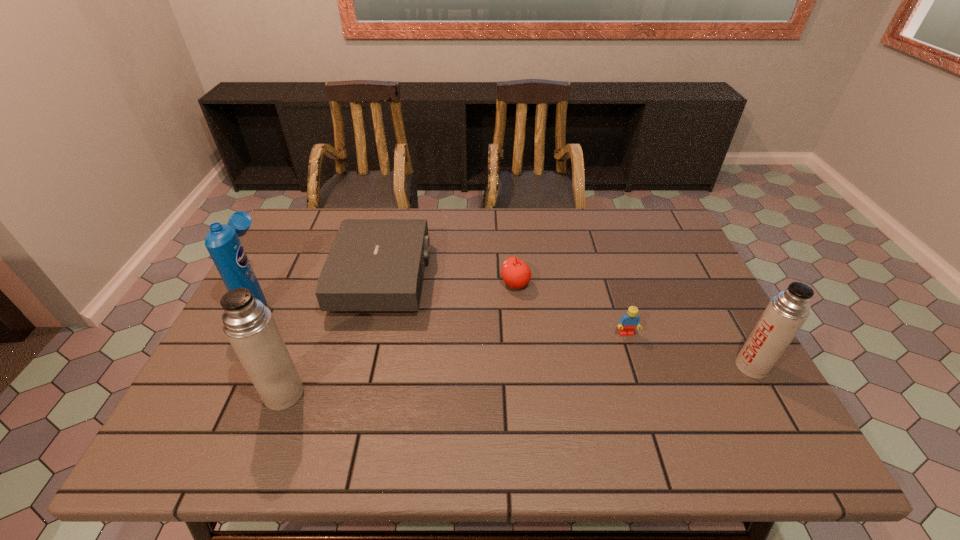
Please point a space for a new thermos_bottle to maintain equal intervals. Please provide its 2D coordinates. Your answer should be formatted as a tuple, i.e. [(x, y)], where the tuple contains the x and y coordinates of a point satisfying the conditions above.

[(524, 380)]